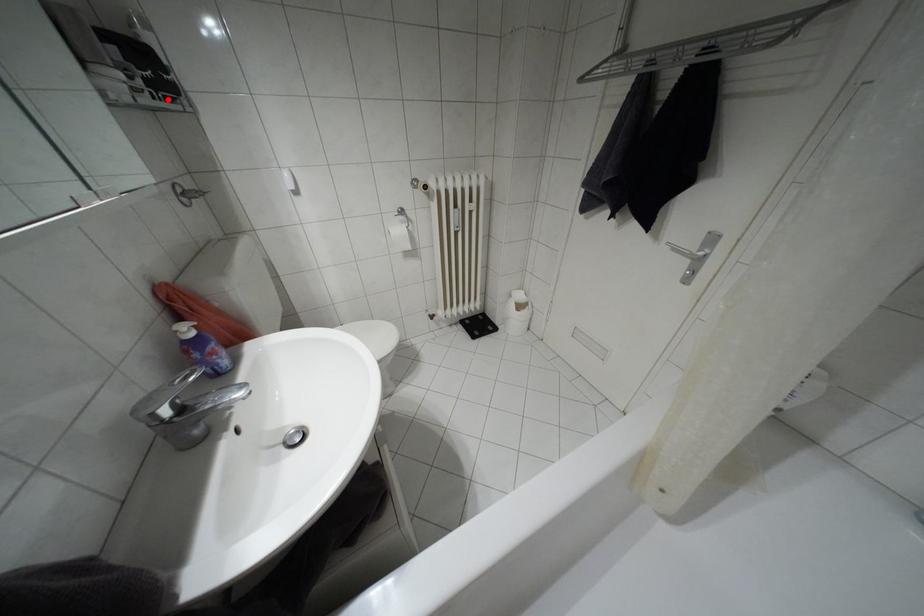
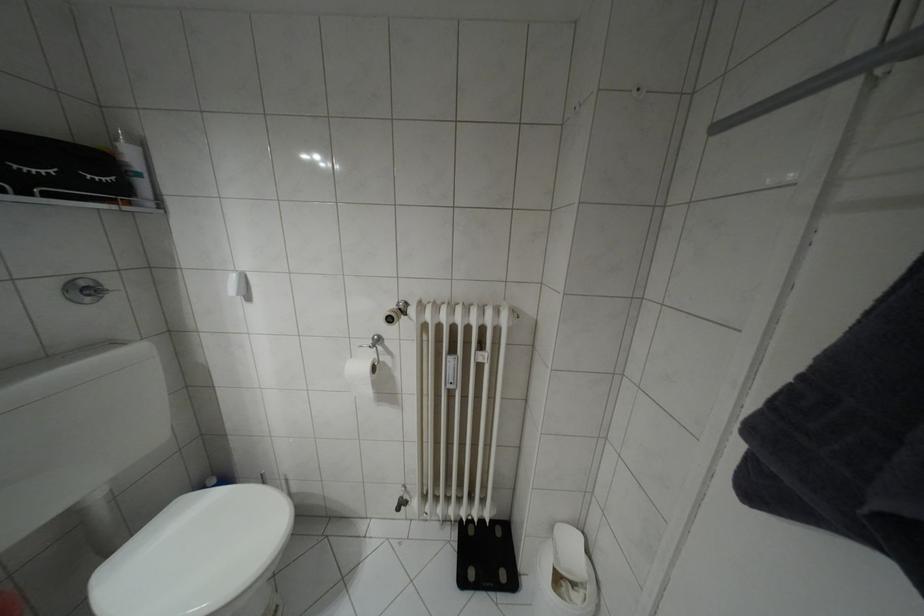
Find the pixel in the second image that matches the highlighted location in the first image.

(49, 195)